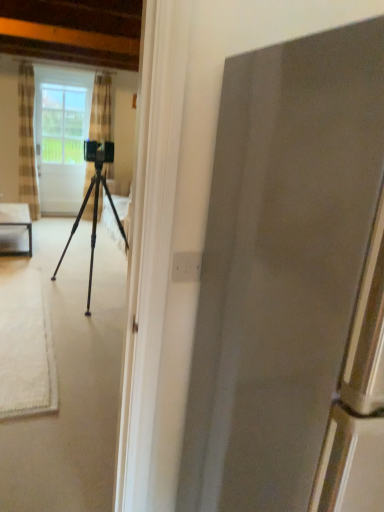
Question: Considering the relative sizes of clear glass screen door at upper left and striped fabric curtain at center, which ranks as the 1th curtain in right-to-left order, in the image provided, is clear glass screen door at upper left thinner than striped fabric curtain at center, which ranks as the 1th curtain in right-to-left order,?

Choices:
 (A) no
 (B) yes

Answer: (B)

Question: Does clear glass screen door at upper left appear on the right side of striped fabric curtain at center, which ranks as the 1th curtain in right-to-left order?

Choices:
 (A) no
 (B) yes

Answer: (A)

Question: Could you tell me if clear glass screen door at upper left is facing striped fabric curtain at center, positioned as the second curtain in left-to-right order?

Choices:
 (A) no
 (B) yes

Answer: (A)

Question: Is clear glass screen door at upper left oriented away from striped fabric curtain at center, positioned as the second curtain in left-to-right order?

Choices:
 (A) no
 (B) yes

Answer: (A)

Question: From a real-world perspective, is clear glass screen door at upper left on top of striped fabric curtain at center, positioned as the second curtain in left-to-right order?

Choices:
 (A) no
 (B) yes

Answer: (A)

Question: From their relative heights in the image, would you say checkered fabric curtain at left, the 1th curtain positioned from the left, is taller or shorter than clear glass screen door at upper left?

Choices:
 (A) short
 (B) tall

Answer: (B)

Question: Looking at the image, does checkered fabric curtain at left, the 1th curtain positioned from the left, seem bigger or smaller compared to clear glass screen door at upper left?

Choices:
 (A) small
 (B) big

Answer: (B)

Question: Is point (33, 176) closer or farther from the camera than point (79, 110)?

Choices:
 (A) farther
 (B) closer

Answer: (B)

Question: Considering the relative positions of checkered fabric curtain at left, the second curtain from the right, and clear glass screen door at upper left in the image provided, is checkered fabric curtain at left, the second curtain from the right, to the left or to the right of clear glass screen door at upper left?

Choices:
 (A) right
 (B) left

Answer: (B)

Question: Is metallic tripod at center to the left or to the right of clear glass table at left in the image?

Choices:
 (A) left
 (B) right

Answer: (B)

Question: Based on their sizes in the image, would you say metallic tripod at center is bigger or smaller than clear glass table at left?

Choices:
 (A) big
 (B) small

Answer: (A)

Question: Is point (94, 222) positioned closer to the camera than point (16, 210)?

Choices:
 (A) farther
 (B) closer

Answer: (B)

Question: Is metallic tripod at center situated inside clear glass table at left or outside?

Choices:
 (A) outside
 (B) inside

Answer: (A)

Question: Considering their positions, is clear glass table at left located in front of or behind checkered fabric curtain at left, the 1th curtain positioned from the left?

Choices:
 (A) behind
 (B) front

Answer: (B)

Question: From a real-world perspective, is clear glass table at left above or below checkered fabric curtain at left, the 1th curtain positioned from the left?

Choices:
 (A) below
 (B) above

Answer: (A)